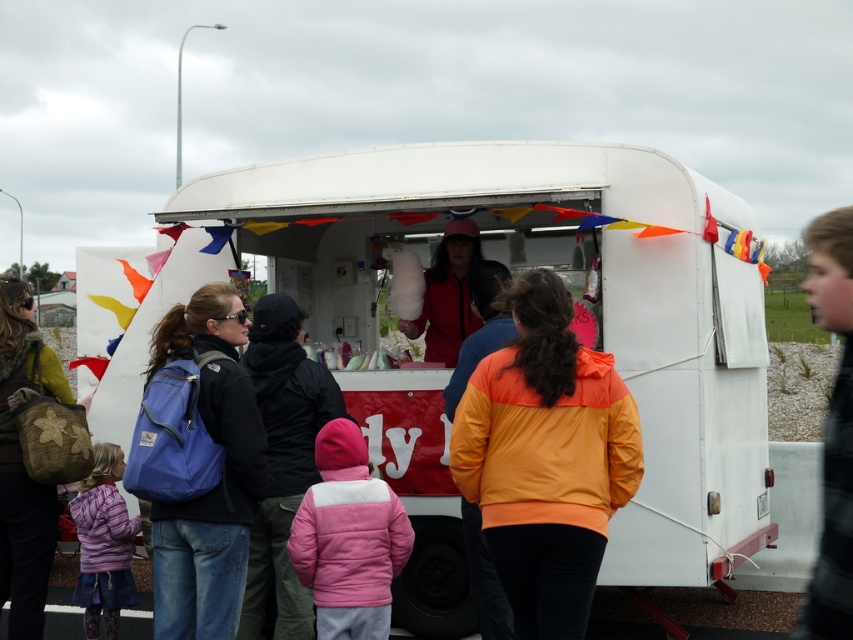
Can you confirm if pink fleece jacket at lower center is positioned to the right of red matte cotton candy at center?

Incorrect, pink fleece jacket at lower center is not on the right side of red matte cotton candy at center.

The height and width of the screenshot is (640, 853). What do you see at coordinates (347, 538) in the screenshot?
I see `pink fleece jacket at lower center` at bounding box center [347, 538].

Find the location of a particular element. Image resolution: width=853 pixels, height=640 pixels. pink fleece jacket at lower center is located at coordinates (347, 538).

Can you confirm if orange fabric jacket at center is positioned to the left of green textured backpack at left?

Incorrect, orange fabric jacket at center is not on the left side of green textured backpack at left.

Can you confirm if orange fabric jacket at center is shorter than green textured backpack at left?

Yes.

Measure the distance between orange fabric jacket at center and camera.

They are 4.95 meters apart.

The width and height of the screenshot is (853, 640). Identify the location of orange fabric jacket at center. (544, 458).

Does white matte food truck at center appear on the right side of pink fleece jacket at lower center?

Yes, white matte food truck at center is to the right of pink fleece jacket at lower center.

Can you confirm if white matte food truck at center is smaller than pink fleece jacket at lower center?

No, white matte food truck at center is not smaller than pink fleece jacket at lower center.

Is point (753, 531) farther from camera compared to point (341, 467)?

Yes, point (753, 531) is farther from viewer.

The height and width of the screenshot is (640, 853). Find the location of `white matte food truck at center`. white matte food truck at center is located at coordinates (514, 273).